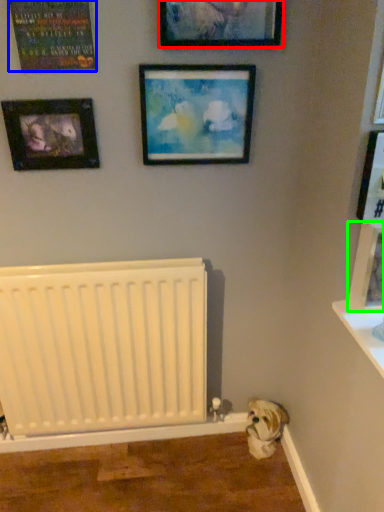
Question: Which object is the farthest from picture frame (highlighted by a red box)? Choose among these: picture frame (highlighted by a blue box) or picture frame (highlighted by a green box).

Choices:
 (A) picture frame
 (B) picture frame

Answer: (B)